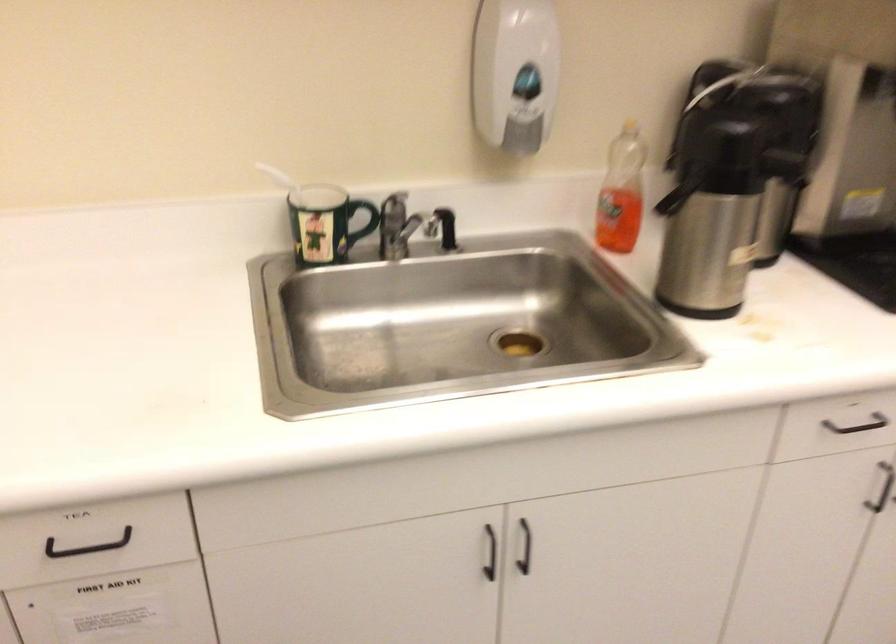
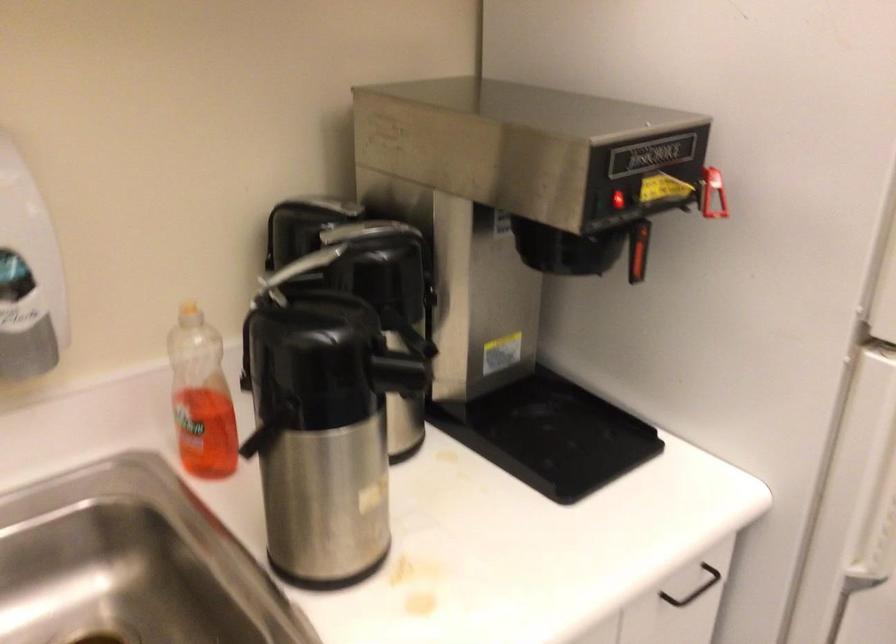
Question: The camera is either moving clockwise (left) or counter-clockwise (right) around the object. The first image is from the beginning of the video and the second image is from the end. Is the camera moving left or right when shooting the video?

Choices:
 (A) Left
 (B) Right

Answer: (A)